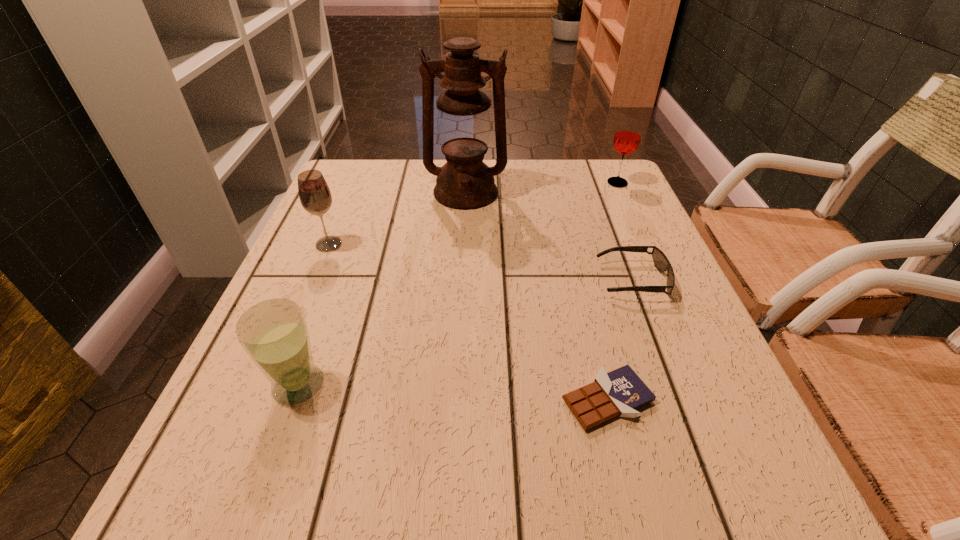
You are a GUI agent. You are given a task and a screenshot of the screen. Output one action in this format:
    pyautogui.click(x=<x>, y=<y>)
    Task: Click on the chocolate bar at the right edge
    The width and height of the screenshot is (960, 540).
    Given the screenshot: What is the action you would take?
    pyautogui.click(x=620, y=392)

Find the location of `object that is at the far right corner`. object that is at the far right corner is located at coordinates (627, 137).

In the image, there is a desktop. What are the coordinates of `vacant space at the far edge` in the screenshot? It's located at (528, 185).

The image size is (960, 540). I want to click on free space at the near edge of the desktop, so click(x=380, y=480).

Locate an element on the screen. The width and height of the screenshot is (960, 540). vacant space at the left edge is located at coordinates (301, 265).

In the image, there is a desktop. Where is `blank space at the right edge`? This screenshot has height=540, width=960. blank space at the right edge is located at coordinates (725, 409).

At what (x,y) coordinates should I click in order to perform the action: click on free space at the far left corner. Please return your answer as a coordinate pair (x, y). Looking at the image, I should click on (353, 183).

The image size is (960, 540). What are the coordinates of `vacant region at the far right corner of the desktop` in the screenshot? It's located at (607, 164).

This screenshot has height=540, width=960. I want to click on vacant space at the near right corner, so click(698, 492).

Image resolution: width=960 pixels, height=540 pixels. In order to click on vacant area that lies between the fourth farthest object and the shortest object in this screenshot , I will do `click(619, 340)`.